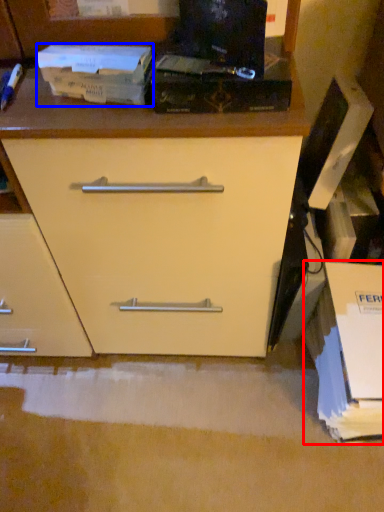
Question: Which object is closer to the camera taking this photo, cardboard box (highlighted by a red box) or paperback book (highlighted by a blue box)?

Choices:
 (A) cardboard box
 (B) paperback book

Answer: (B)